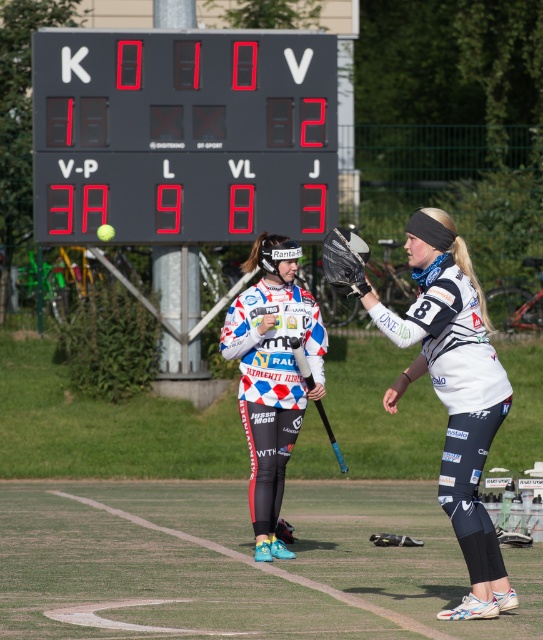
Does point (255, 81) come in front of point (272, 400)?

No.

Does point (102, 90) come farther from viewer compared to point (280, 296)?

Yes, it is.

Locate an element on the screen. black digital scoreboard at upper center is located at coordinates (184, 134).

Who is positioned more to the left, black digital scoreboard at upper center or white matte jersey at center?

black digital scoreboard at upper center is more to the left.

Can you confirm if black digital scoreboard at upper center is positioned below white matte jersey at center?

Actually, black digital scoreboard at upper center is above white matte jersey at center.

Who is more distant from viewer, [287,195] or [468,276]?

The point [287,195] is more distant.

The height and width of the screenshot is (640, 543). Find the location of `black digital scoreboard at upper center`. black digital scoreboard at upper center is located at coordinates (184, 134).

Is white matte jersey at center above blue rubber hockey bat at center?

Indeed, white matte jersey at center is positioned over blue rubber hockey bat at center.

Does white matte jersey at center appear under blue rubber hockey bat at center?

Actually, white matte jersey at center is above blue rubber hockey bat at center.

Who is more forward, (446, 337) or (300, 371)?

Point (446, 337) is in front.

Where is `white matte jersey at center`? The height and width of the screenshot is (640, 543). white matte jersey at center is located at coordinates [x=445, y=381].